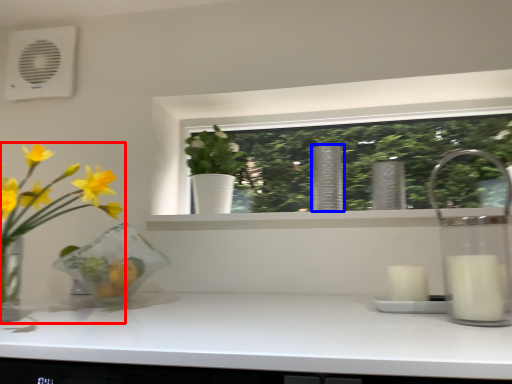
Question: Which object appears closest to the camera in this image, houseplant (highlighted by a red box) or vase (highlighted by a blue box)?

Choices:
 (A) houseplant
 (B) vase

Answer: (A)